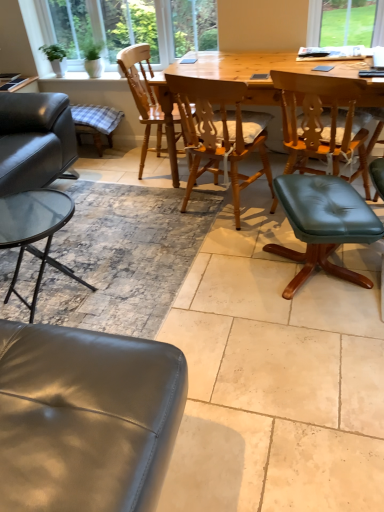
What are the coordinates of `free point to the left of teal leather stool at center-right, which is the first bar stool in right-to-left order` in the screenshot? It's located at (221, 276).